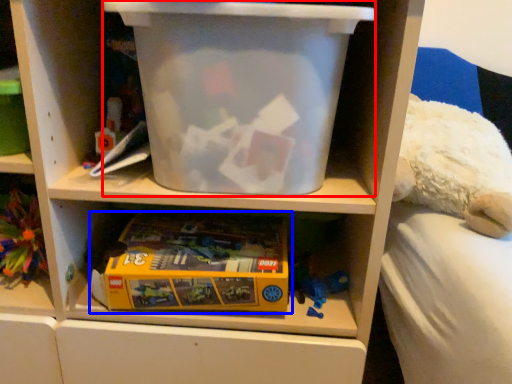
Question: Which of the following is the closest to the observer, storage box (highlighted by a red box) or toy (highlighted by a blue box)?

Choices:
 (A) storage box
 (B) toy

Answer: (A)